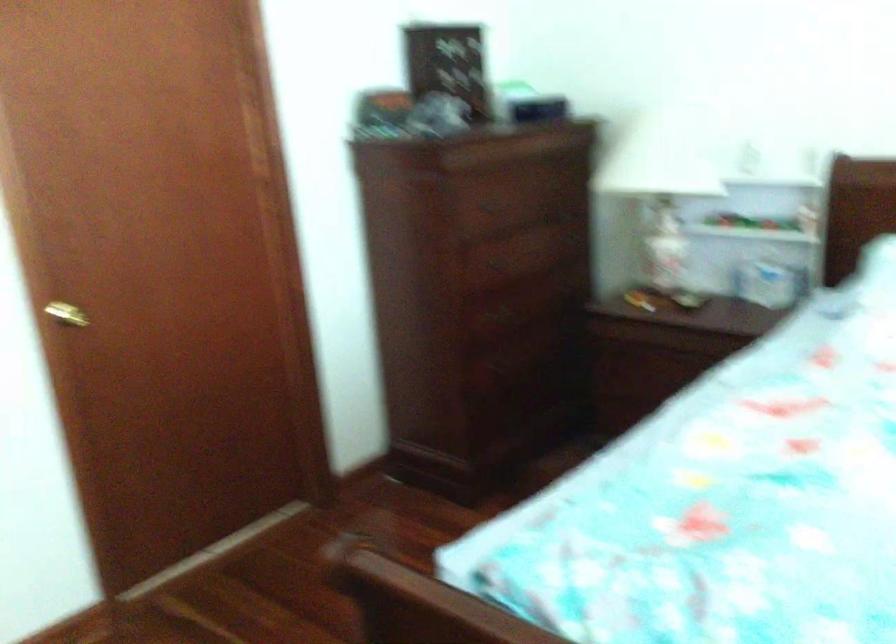
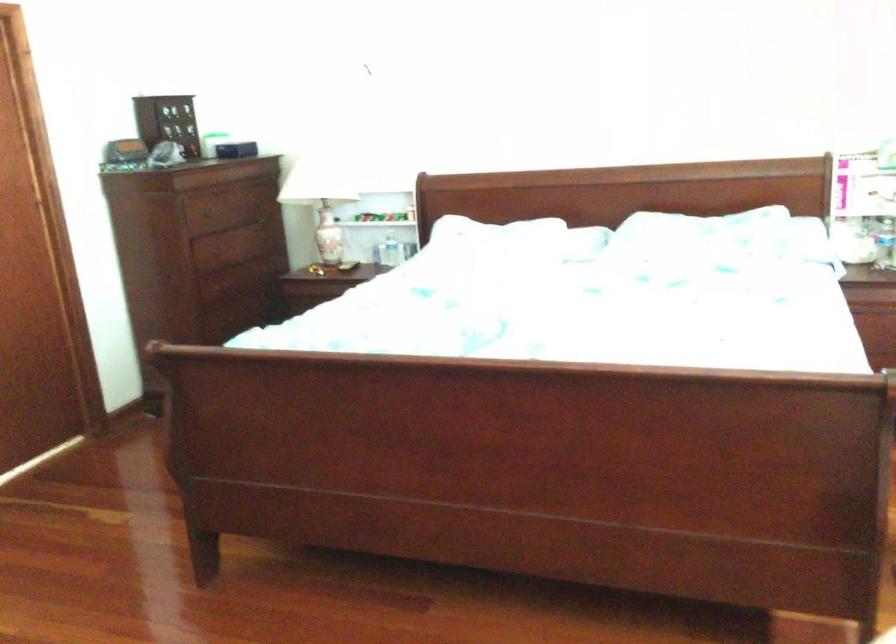
The point at (424, 227) is marked in the first image. Where is the corresponding point in the second image?

(209, 252)